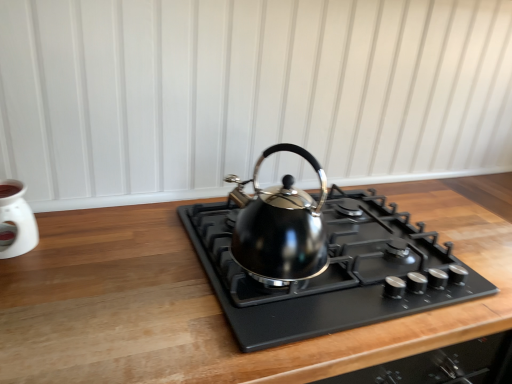
Question: Considering the relative positions of white glossy oil burner at left and black metallic kettle at center in the image provided, is white glossy oil burner at left to the left of black metallic kettle at center from the viewer's perspective?

Choices:
 (A) yes
 (B) no

Answer: (A)

Question: From a real-world perspective, is white glossy oil burner at left below black metallic kettle at center?

Choices:
 (A) no
 (B) yes

Answer: (B)

Question: Is white glossy oil burner at left not inside black metallic kettle at center?

Choices:
 (A) yes
 (B) no

Answer: (A)

Question: Is white glossy oil burner at left next to black metallic kettle at center?

Choices:
 (A) yes
 (B) no

Answer: (B)

Question: Is black metallic kettle at center at the back of white glossy oil burner at left?

Choices:
 (A) yes
 (B) no

Answer: (B)

Question: Can you confirm if white glossy oil burner at left is positioned to the right of black metallic kettle at center?

Choices:
 (A) no
 (B) yes

Answer: (A)

Question: Can you confirm if black metallic kettle at center is bigger than black matte gas stove at center?

Choices:
 (A) no
 (B) yes

Answer: (A)

Question: Would you say black metallic kettle at center contains black matte gas stove at center?

Choices:
 (A) no
 (B) yes

Answer: (A)

Question: Does black metallic kettle at center come behind black matte gas stove at center?

Choices:
 (A) no
 (B) yes

Answer: (B)

Question: From a real-world perspective, is black metallic kettle at center on black matte gas stove at center?

Choices:
 (A) no
 (B) yes

Answer: (B)

Question: Would you say black metallic kettle at center is a long distance from black matte gas stove at center?

Choices:
 (A) yes
 (B) no

Answer: (B)

Question: Does black metallic kettle at center have a greater width compared to black matte gas stove at center?

Choices:
 (A) yes
 (B) no

Answer: (B)

Question: Is white glossy oil burner at left inside black metallic kettle at center?

Choices:
 (A) yes
 (B) no

Answer: (B)